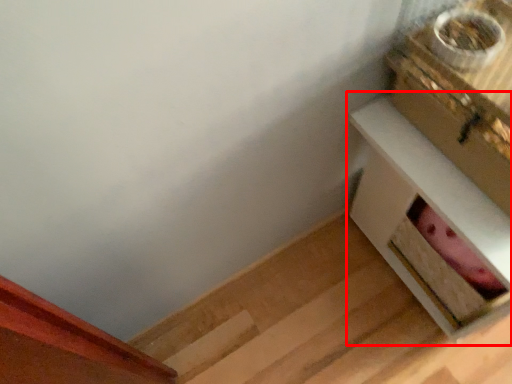
Question: From the image's perspective, what is the correct spatial relationship of table (annotated by the red box) in relation to box?

Choices:
 (A) above
 (B) below

Answer: (B)